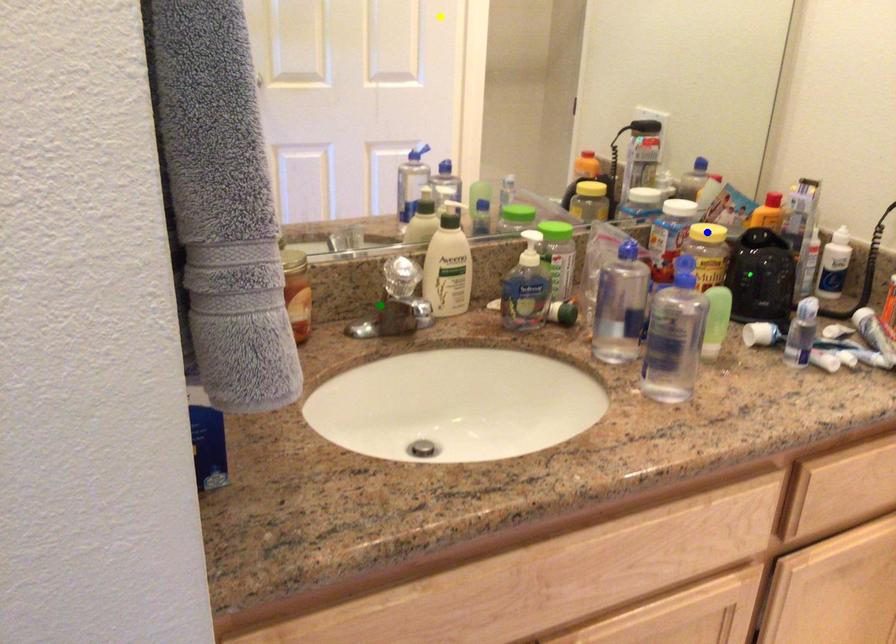
Order these from nearest to farthest:
blue point
green point
yellow point

yellow point
blue point
green point